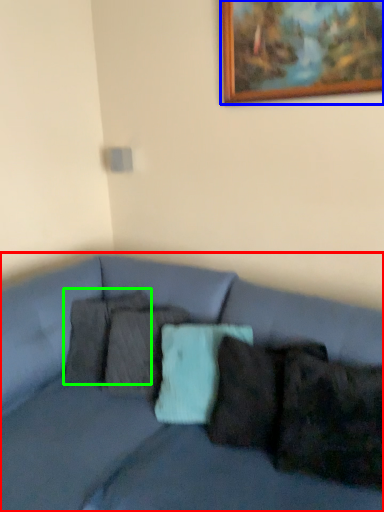
Question: Which object is positioned farthest from studio couch (highlighted by a red box)? Select from picture frame (highlighted by a blue box) and pillow (highlighted by a green box).

Choices:
 (A) picture frame
 (B) pillow

Answer: (A)